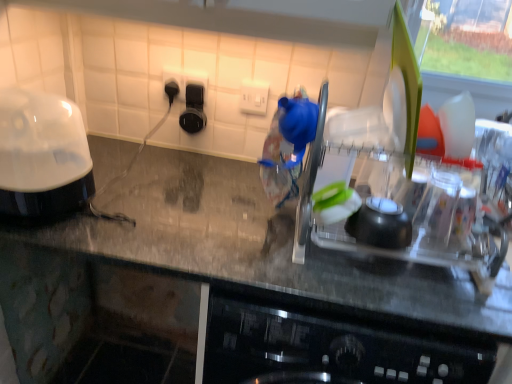
Question: Can you confirm if black plastic outlet at upper center, which ranks as the first electric outlet in left-to-right order, is wider than transparent plastic dish rack at center?

Choices:
 (A) yes
 (B) no

Answer: (B)

Question: From the image's perspective, does black plastic outlet at upper center, the second electric outlet viewed from the right, appear lower than transparent plastic dish rack at center?

Choices:
 (A) yes
 (B) no

Answer: (B)

Question: Is the depth of black plastic outlet at upper center, which ranks as the first electric outlet in left-to-right order, greater than that of transparent plastic dish rack at center?

Choices:
 (A) no
 (B) yes

Answer: (B)

Question: From a real-world perspective, is black plastic outlet at upper center, which ranks as the first electric outlet in left-to-right order, physically below transparent plastic dish rack at center?

Choices:
 (A) yes
 (B) no

Answer: (B)

Question: Can you confirm if black plastic outlet at upper center, the second electric outlet viewed from the right, is positioned to the right of transparent plastic dish rack at center?

Choices:
 (A) yes
 (B) no

Answer: (B)

Question: Is transparent plastic dish rack at center inside the boundaries of black plastic outlet at upper center, the second electric outlet viewed from the right, or outside?

Choices:
 (A) outside
 (B) inside

Answer: (A)

Question: Based on their positions, is transparent plastic dish rack at center located to the left or right of black plastic outlet at upper center, the second electric outlet viewed from the right?

Choices:
 (A) right
 (B) left

Answer: (A)

Question: Relative to black plastic outlet at upper center, the second electric outlet viewed from the right, is transparent plastic dish rack at center in front or behind?

Choices:
 (A) front
 (B) behind

Answer: (A)

Question: Is transparent plastic dish rack at center bigger or smaller than black plastic outlet at upper center, which ranks as the first electric outlet in left-to-right order?

Choices:
 (A) small
 (B) big

Answer: (B)

Question: Is white plastic electric outlet at center, which is counted as the 2th electric outlet, starting from the left, to the left or to the right of clear plastic dish rack at center in the image?

Choices:
 (A) right
 (B) left

Answer: (B)

Question: In terms of height, does white plastic electric outlet at center, placed as the first electric outlet when sorted from right to left, look taller or shorter compared to clear plastic dish rack at center?

Choices:
 (A) short
 (B) tall

Answer: (A)

Question: Is white plastic electric outlet at center, placed as the first electric outlet when sorted from right to left, bigger or smaller than clear plastic dish rack at center?

Choices:
 (A) big
 (B) small

Answer: (B)

Question: Looking at their shapes, would you say white plastic electric outlet at center, placed as the first electric outlet when sorted from right to left, is wider or thinner than clear plastic dish rack at center?

Choices:
 (A) wide
 (B) thin

Answer: (B)

Question: From a real-world perspective, is transparent plastic dish rack at center physically located above or below clear plastic dish rack at center?

Choices:
 (A) above
 (B) below

Answer: (B)

Question: Is transparent plastic dish rack at center spatially inside clear plastic dish rack at center, or outside of it?

Choices:
 (A) outside
 (B) inside

Answer: (A)